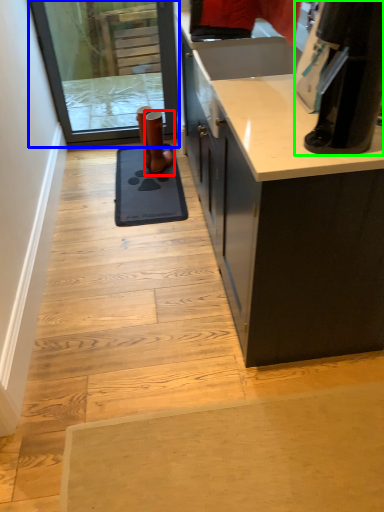
Question: Estimate the real-world distances between objects in this image. Which object is farther from footwear (highlighted by a red box), screen door (highlighted by a blue box) or appliance (highlighted by a green box)?

Choices:
 (A) screen door
 (B) appliance

Answer: (B)